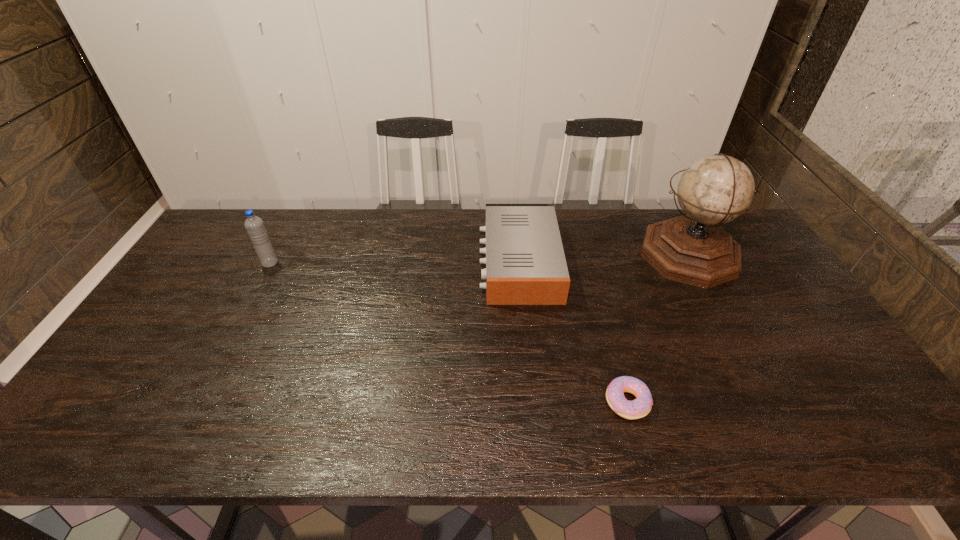
Locate an element on the screen. vacant space that satisfies the following two spatial constraints: 1. on the control panel of the third tallest object; 2. on the back side of the nearest object is located at coordinates (533, 402).

Find the location of a particular element. This screenshot has width=960, height=540. vacant position in the image that satisfies the following two spatial constraints: 1. on the surface of the rightmost object; 2. on the front side of the nearest object is located at coordinates (767, 402).